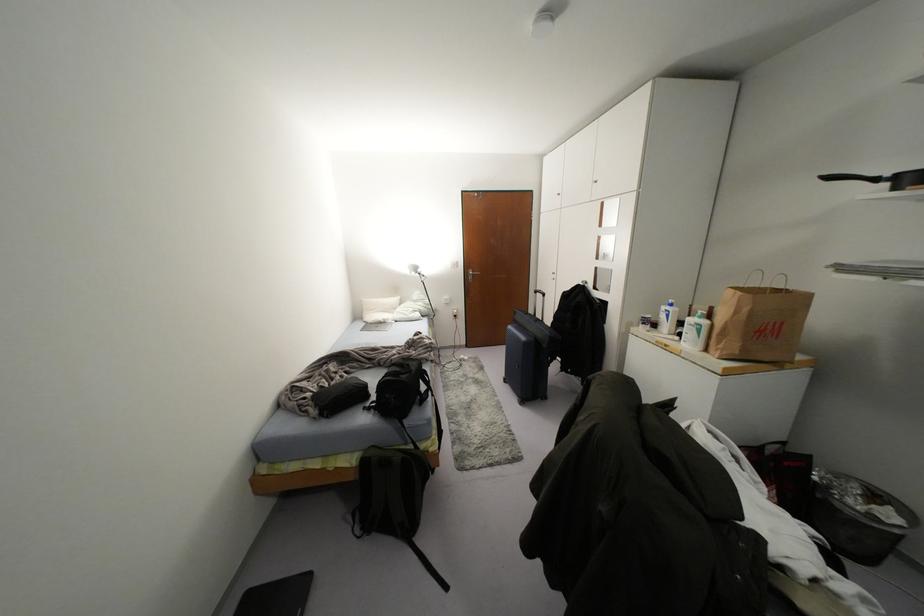
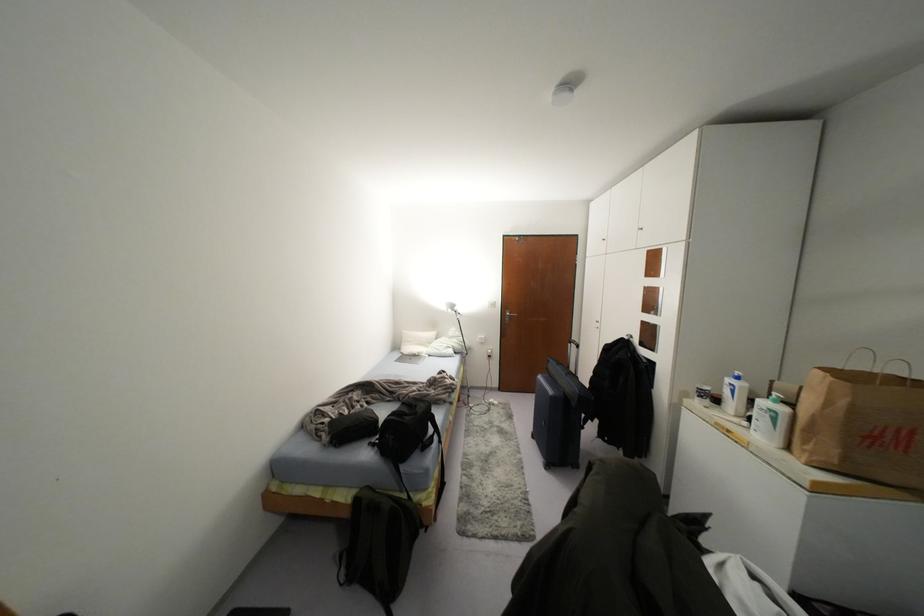
Question: The camera is either moving clockwise (left) or counter-clockwise (right) around the object. The first image is from the beginning of the video and the second image is from the end. Is the camera moving left or right when shooting the video?

Choices:
 (A) Left
 (B) Right

Answer: (B)